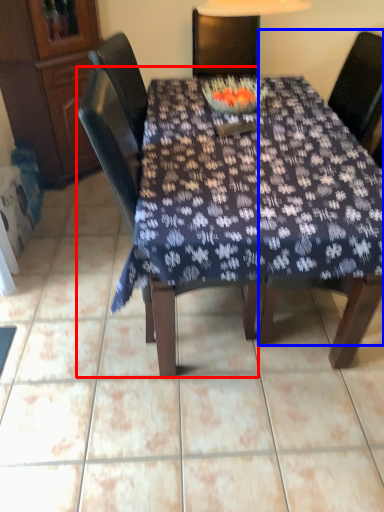
Question: Which point is closer to the camera, chair (highlighted by a red box) or chair (highlighted by a blue box)?

Choices:
 (A) chair
 (B) chair

Answer: (A)